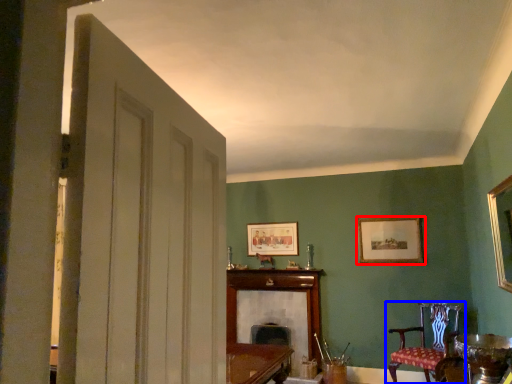
Question: Which of the following is the closest to the observer, picture frame (highlighted by a red box) or chair (highlighted by a blue box)?

Choices:
 (A) picture frame
 (B) chair

Answer: (B)